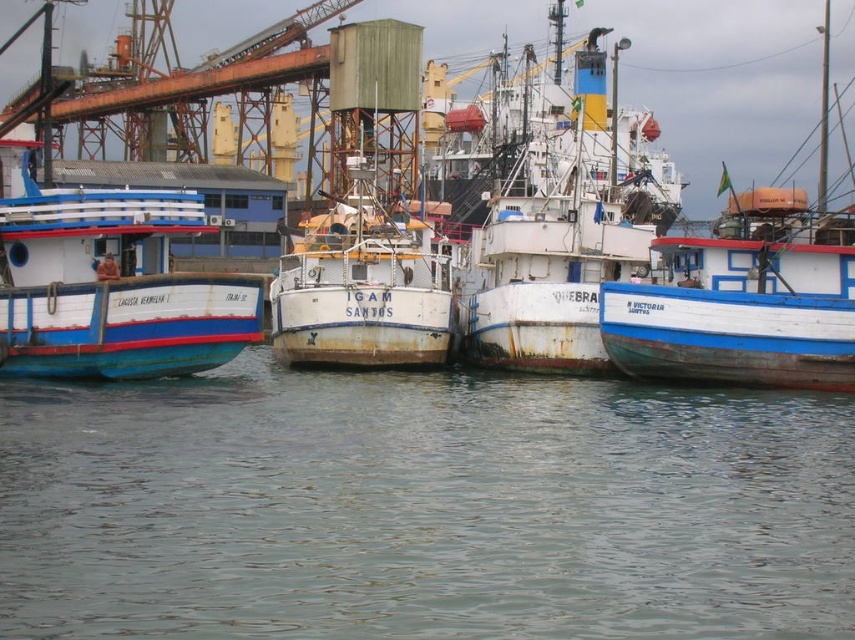
Question: Does clear water at center have a larger size compared to white weathered ship at center?

Choices:
 (A) yes
 (B) no

Answer: (B)

Question: Which point is farther from the camera taking this photo?

Choices:
 (A) (108, 259)
 (B) (621, 561)
 (C) (514, 312)

Answer: (C)

Question: Can you confirm if clear water at center is positioned to the left of white weathered ship at center?

Choices:
 (A) yes
 (B) no

Answer: (A)

Question: Among these objects, which one is nearest to the camera?

Choices:
 (A) white weathered ship at center
 (B) clear water at center
 (C) blue painted wooden boat at left

Answer: (B)

Question: Among these points, which one is farthest from the camera?

Choices:
 (A) (647, 250)
 (B) (166, 502)
 (C) (105, 268)

Answer: (A)

Question: Can you confirm if white weathered ship at center is bigger than blue painted wooden boat at left?

Choices:
 (A) yes
 (B) no

Answer: (A)